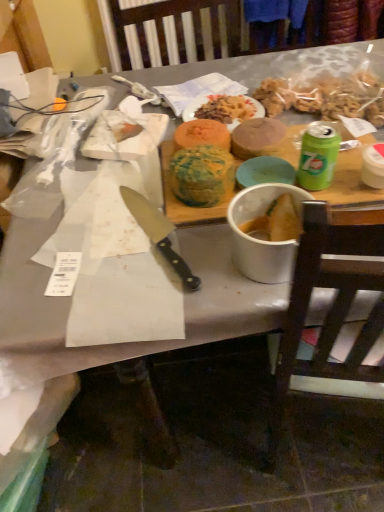
Question: Can you confirm if multicolored cake at center, the 2th food in the right-to-left sequence, is positioned to the left of brown wooden chair at right?

Choices:
 (A) yes
 (B) no

Answer: (A)

Question: Considering the relative sizes of multicolored cake at center, the 2th food in the right-to-left sequence, and brown wooden chair at right in the image provided, is multicolored cake at center, the 2th food in the right-to-left sequence, bigger than brown wooden chair at right?

Choices:
 (A) no
 (B) yes

Answer: (A)

Question: Does multicolored cake at center, placed as the second food when sorted from left to right, have a greater height compared to brown wooden chair at right?

Choices:
 (A) no
 (B) yes

Answer: (A)

Question: Is multicolored cake at center, the 2th food in the right-to-left sequence, located outside brown wooden chair at right?

Choices:
 (A) yes
 (B) no

Answer: (A)

Question: Can you confirm if multicolored cake at center, the 2th food in the right-to-left sequence, is smaller than brown wooden chair at right?

Choices:
 (A) yes
 (B) no

Answer: (A)

Question: Is multicolored cake at center, the 2th food in the right-to-left sequence, wider than brown wooden chair at right?

Choices:
 (A) no
 (B) yes

Answer: (A)

Question: Is white matte bowl at center far from smooth brown cake at center, the 3th food when ordered from left to right?

Choices:
 (A) yes
 (B) no

Answer: (B)

Question: From the image's perspective, is white matte bowl at center above smooth brown cake at center, the 3th food when ordered from left to right?

Choices:
 (A) yes
 (B) no

Answer: (B)

Question: From a real-world perspective, does white matte bowl at center stand above smooth brown cake at center, the 1th food when ordered from right to left?

Choices:
 (A) yes
 (B) no

Answer: (A)

Question: Considering the relative sizes of white matte bowl at center and smooth brown cake at center, the 1th food when ordered from right to left, in the image provided, is white matte bowl at center wider than smooth brown cake at center, the 1th food when ordered from right to left,?

Choices:
 (A) no
 (B) yes

Answer: (B)

Question: From a real-world perspective, is white matte bowl at center located beneath smooth brown cake at center, the 1th food when ordered from right to left?

Choices:
 (A) no
 (B) yes

Answer: (A)

Question: Is white matte bowl at center oriented away from smooth brown cake at center, the 3th food when ordered from left to right?

Choices:
 (A) yes
 (B) no

Answer: (A)

Question: Is white matte bowl at center positioned before brown wooden chair at right?

Choices:
 (A) no
 (B) yes

Answer: (A)